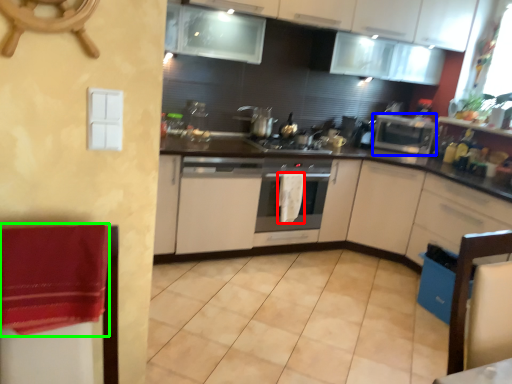
Question: Which object is the closest to the hand towel (highlighted by a red box)? Choose among these: appliance (highlighted by a blue box) or blanket (highlighted by a green box).

Choices:
 (A) appliance
 (B) blanket

Answer: (A)